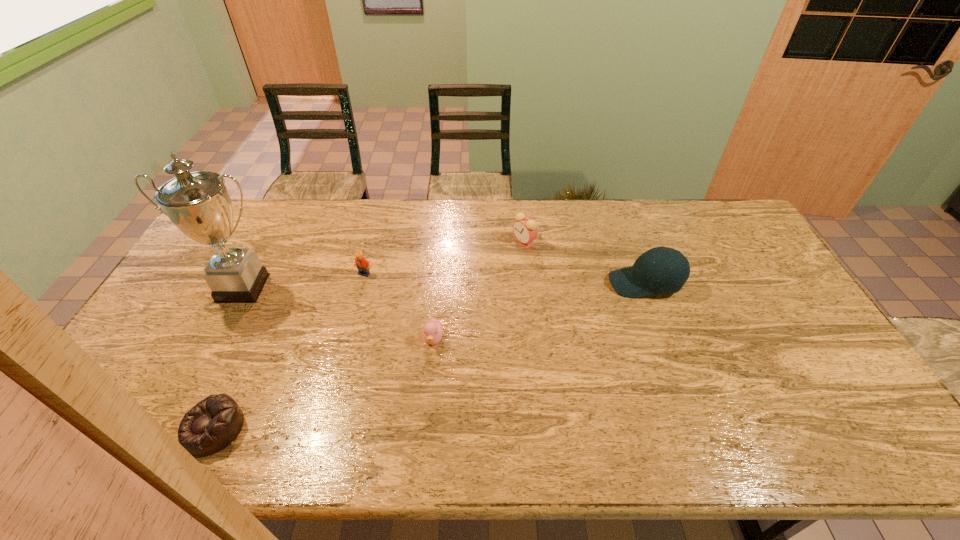
You are a GUI agent. You are given a task and a screenshot of the screen. Output one action in this format:
    pyautogui.click(x=<x>, y=<y>)
    Task: Click on the tallest object
    The image size is (960, 540).
    Given the screenshot: What is the action you would take?
    pyautogui.click(x=197, y=203)

I want to click on baseball cap, so click(x=671, y=270).

At what (x,y) coordinates should I click in order to perform the action: click on the rightmost object. Please return your answer as a coordinate pair (x, y). This screenshot has height=540, width=960. Looking at the image, I should click on (671, 270).

Find the location of a particular element. the second object from right to left is located at coordinates (525, 230).

Image resolution: width=960 pixels, height=540 pixels. I want to click on alarm clock, so click(x=525, y=230).

This screenshot has height=540, width=960. In order to click on Lego in this screenshot , I will do `click(362, 264)`.

Image resolution: width=960 pixels, height=540 pixels. Find the location of `the fifth farthest object`. the fifth farthest object is located at coordinates (433, 330).

The width and height of the screenshot is (960, 540). Find the location of `duckling`. duckling is located at coordinates (433, 330).

This screenshot has width=960, height=540. Identify the location of beanbag. (214, 423).

At what (x,y) coordinates should I click in order to perform the action: click on vacant space positioned 0.360m at the front view of the tallest object. Please return your answer as a coordinate pair (x, y). The image size is (960, 540). Looking at the image, I should click on (173, 419).